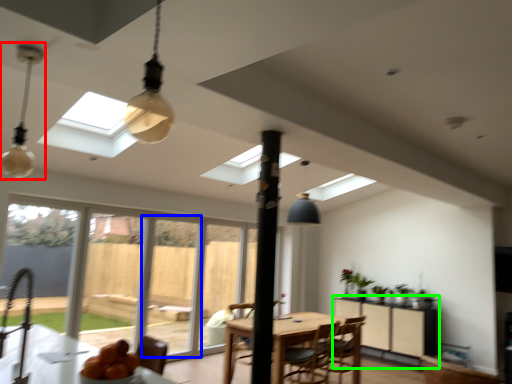
Question: Based on their relative distances, which object is nearer to lamp (highlighted by a red box)? Choose from screen door (highlighted by a blue box) and cabinetry (highlighted by a green box).

Choices:
 (A) screen door
 (B) cabinetry

Answer: (A)